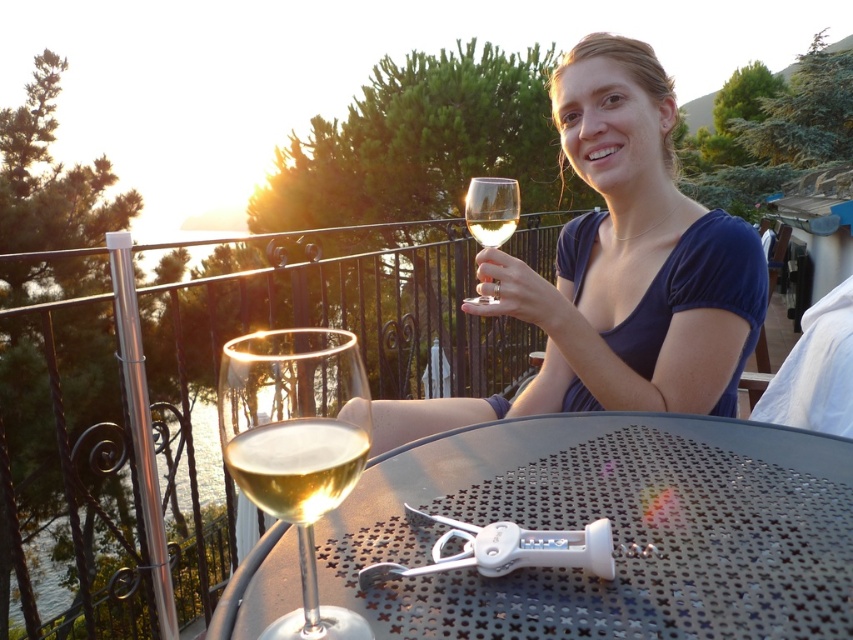
Is point (292, 380) farther from camera compared to point (347, 477)?

No, it is not.

Who is lower down, clear glass wine glass at center or clear glass wine at lower left?

clear glass wine glass at center

Consider the image. Who is more forward, [288,429] or [320,493]?

Point [288,429]

Locate an element on the screen. Image resolution: width=853 pixels, height=640 pixels. clear glass wine glass at center is located at coordinates (297, 445).

Can you confirm if metallic gray table at center is wider than clear glass wine at lower left?

Yes.

Who is shorter, metallic gray table at center or clear glass wine at lower left?

Standing shorter between the two is clear glass wine at lower left.

This screenshot has height=640, width=853. Describe the element at coordinates (612, 529) in the screenshot. I see `metallic gray table at center` at that location.

The image size is (853, 640). Find the location of `metallic gray table at center`. metallic gray table at center is located at coordinates (612, 529).

Can you confirm if metallic gray table at center is taller than matte glass wine glass at center?

In fact, metallic gray table at center may be shorter than matte glass wine glass at center.

Find the location of `metallic gray table at center`. metallic gray table at center is located at coordinates (612, 529).

Find the location of a particular element. The width and height of the screenshot is (853, 640). metallic gray table at center is located at coordinates (612, 529).